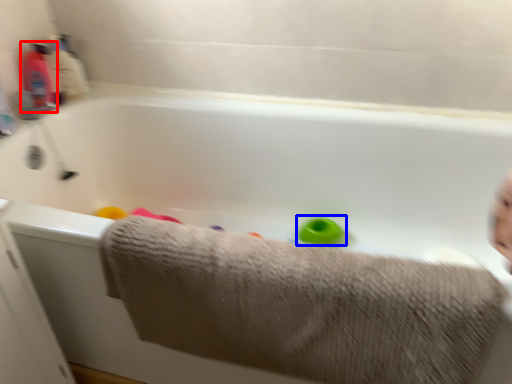
Question: Which point is further to the camera, baby bottle (highlighted by a red box) or toy (highlighted by a blue box)?

Choices:
 (A) baby bottle
 (B) toy

Answer: (B)